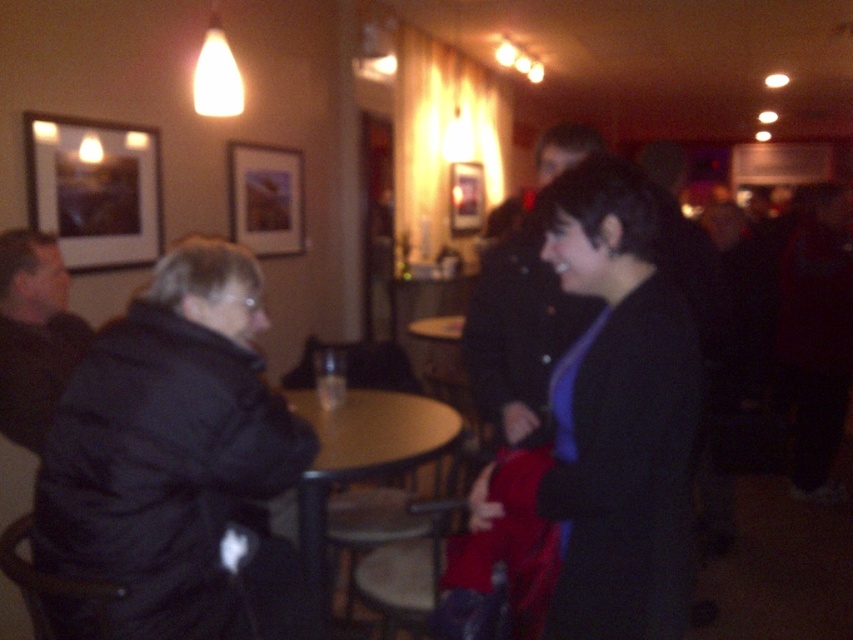
From the picture: You are a photographer trying to capture a candid shot of the two people in the black puffy coat at left and dark gray jacket at left. Your camera has a depth of field that can focus on objects within a 70 cm range. Will both subjects be in focus?

The black puffy coat at left is 73.01 centimeters away from dark gray jacket at left. Since the distance between them exceeds the camera sensor range of 70 cm, only one of them will be in focus at a time.

You are at a party and want to take a photo of the dark blue jacket at center without including the wooden framed picture at upper center in the frame. Is it possible based on their positions?

The dark blue jacket at center is positioned under the wooden framed picture at upper center, so if you lower your camera angle slightly to focus on the jacket while avoiding the picture above it, it should be possible to take the photo without including the wooden framed picture at upper center.